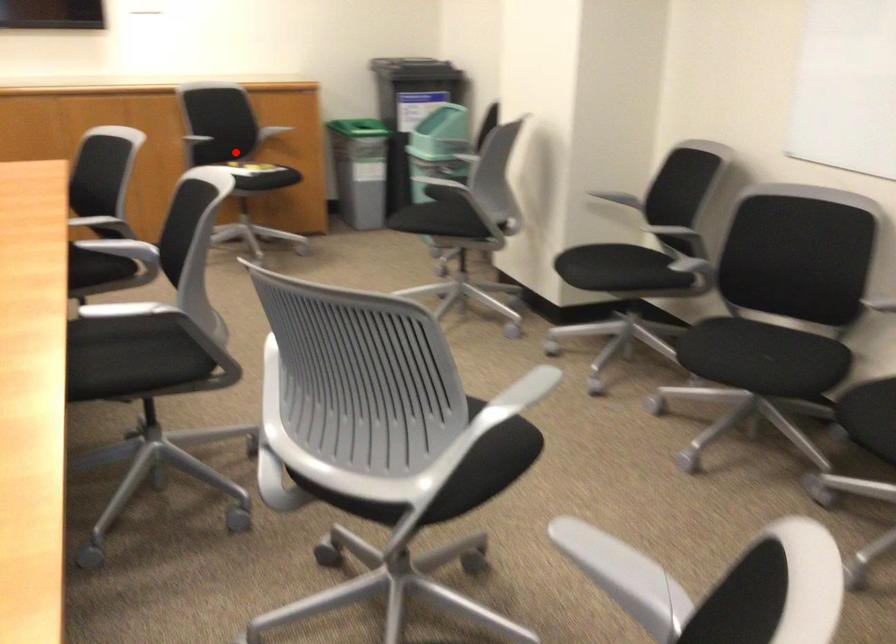
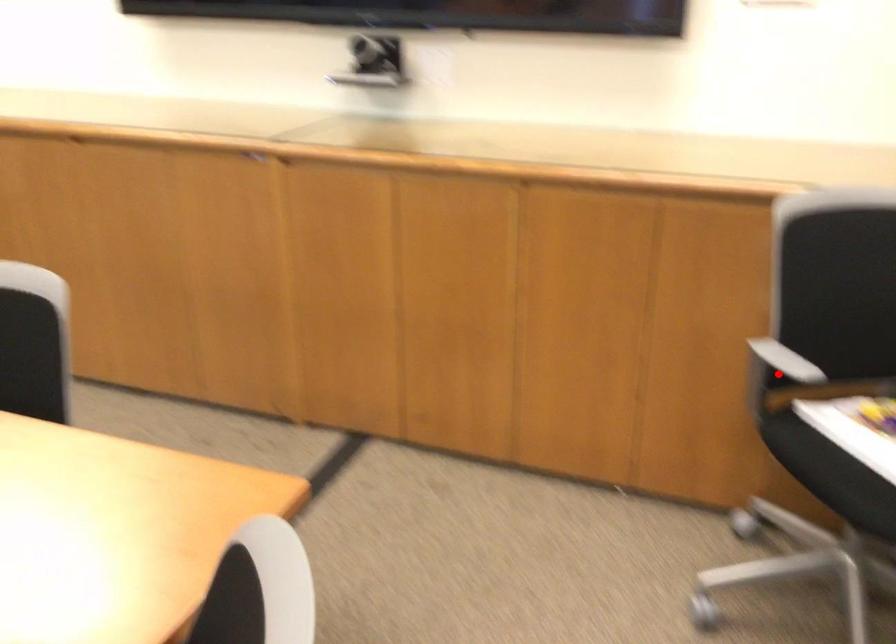
I am providing you with two images of the same scene from different viewpoints. A red point is marked on the first image and another point is marked on the second image. Do the highlighted points in image1 and image2 indicate the same real-world spot?

No